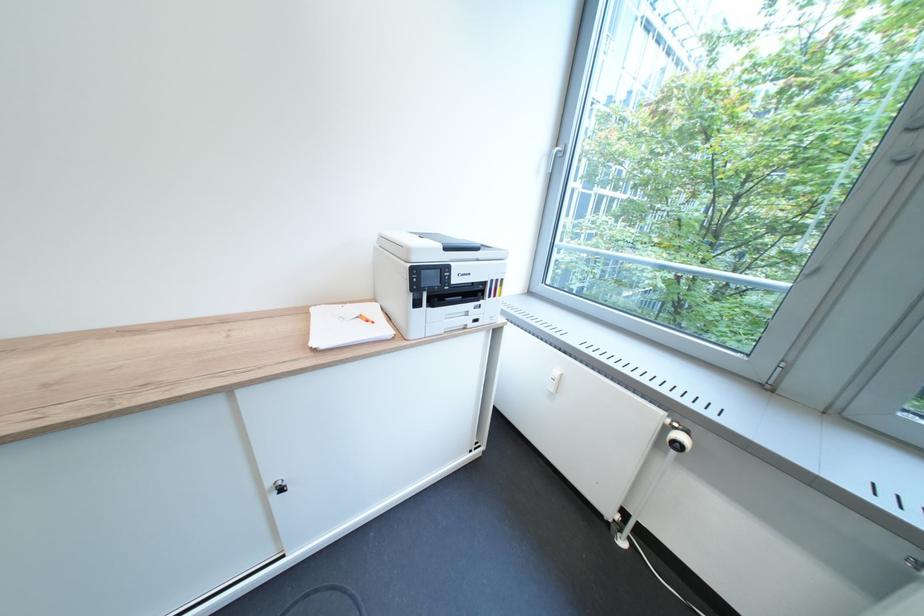
You are a GUI agent. You are given a task and a screenshot of the screen. Output one action in this format:
    pyautogui.click(x=<x>, y=<y>)
    Task: Click on the white wall switch
    Image resolution: width=924 pixels, height=616 pixels.
    Given the screenshot: What is the action you would take?
    pyautogui.click(x=553, y=381)